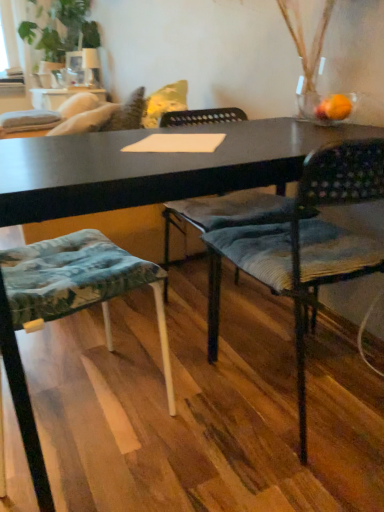
Question: From the image's perspective, is textured fabric chair at center, the 2th chair positioned from the left, over textured fabric cushion at lower left, which is the 1th chair from left to right?

Choices:
 (A) no
 (B) yes

Answer: (B)

Question: Could textured fabric cushion at lower left, the 2th chair viewed from the right, be considered to be inside textured fabric chair at center, placed as the first chair when sorted from right to left?

Choices:
 (A) no
 (B) yes

Answer: (A)

Question: Is textured fabric chair at center, placed as the first chair when sorted from right to left, to the right of textured fabric cushion at lower left, the 2th chair viewed from the right, from the viewer's perspective?

Choices:
 (A) no
 (B) yes

Answer: (B)

Question: Is the position of textured fabric chair at center, placed as the first chair when sorted from right to left, less distant than that of textured fabric cushion at lower left, the 2th chair viewed from the right?

Choices:
 (A) no
 (B) yes

Answer: (A)

Question: Is textured fabric chair at center, placed as the first chair when sorted from right to left, touching textured fabric cushion at lower left, the 2th chair viewed from the right?

Choices:
 (A) no
 (B) yes

Answer: (A)

Question: Is textured fabric chair at center, placed as the first chair when sorted from right to left, turned away from textured fabric cushion at lower left, the 2th chair viewed from the right?

Choices:
 (A) no
 (B) yes

Answer: (A)

Question: From a real-world perspective, is green leafy plant at upper left on textured fabric cushion at lower left, which is the 1th chair from left to right?

Choices:
 (A) no
 (B) yes

Answer: (B)

Question: Does green leafy plant at upper left come behind textured fabric cushion at lower left, which is the 1th chair from left to right?

Choices:
 (A) no
 (B) yes

Answer: (B)

Question: Considering the relative sizes of green leafy plant at upper left and textured fabric cushion at lower left, the 2th chair viewed from the right, in the image provided, is green leafy plant at upper left bigger than textured fabric cushion at lower left, the 2th chair viewed from the right,?

Choices:
 (A) no
 (B) yes

Answer: (B)

Question: Would you say green leafy plant at upper left is a long distance from textured fabric cushion at lower left, the 2th chair viewed from the right?

Choices:
 (A) yes
 (B) no

Answer: (A)

Question: Is green leafy plant at upper left not inside textured fabric cushion at lower left, the 2th chair viewed from the right?

Choices:
 (A) no
 (B) yes

Answer: (B)

Question: From the image's perspective, would you say green leafy plant at upper left is positioned over textured fabric cushion at lower left, which is the 1th chair from left to right?

Choices:
 (A) no
 (B) yes

Answer: (B)

Question: Can textured fabric chair at center, the 2th chair positioned from the left, be found inside green leafy plant at upper left?

Choices:
 (A) no
 (B) yes

Answer: (A)